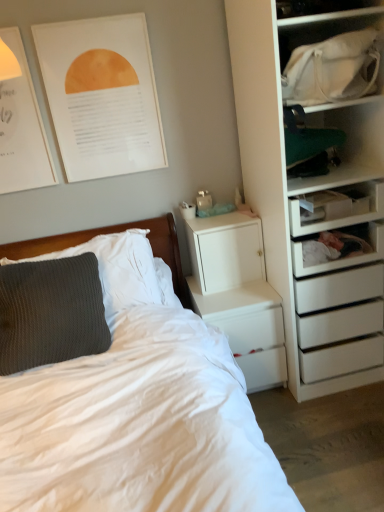
In order to click on empty space that is ontop of white matte/file cabinet at upper right in this screenshot , I will do `click(211, 213)`.